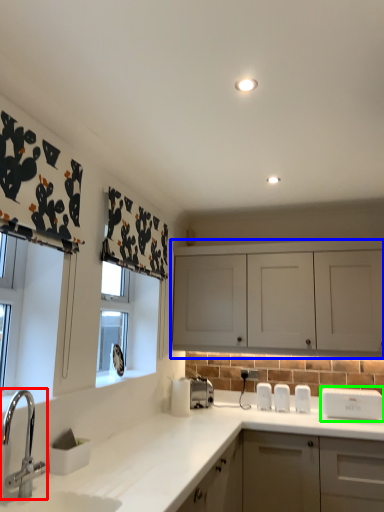
Question: Which is farther away from tap (highlighted by a red box)? cabinetry (highlighted by a blue box) or appliance (highlighted by a green box)?

Choices:
 (A) cabinetry
 (B) appliance

Answer: (B)